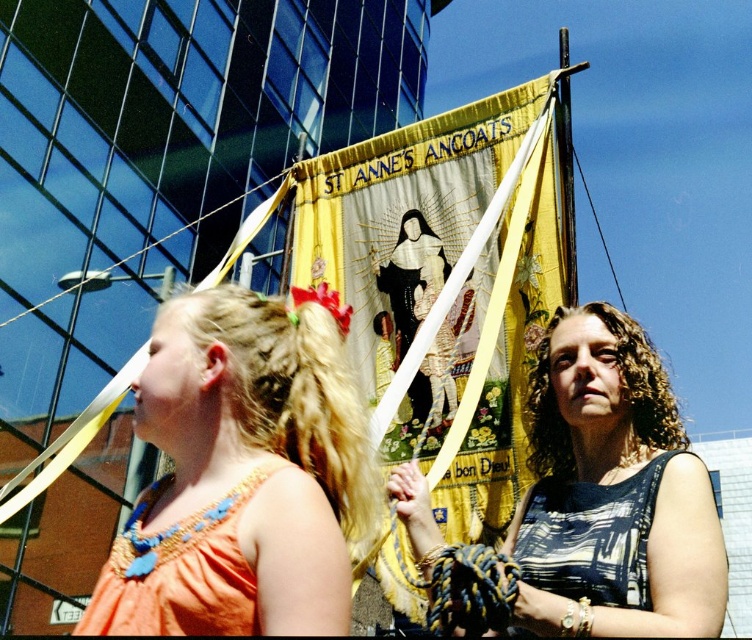
You are a photographer standing near the orange fabric dress at left and want to take a photo of the printed fabric dress at center. Considering the distance between them, will you be able to capture both dresses in the same frame without moving closer?

The distance between the orange fabric dress at left and the printed fabric dress at center is 27.79 feet. Since the photographer is at the orange fabric dress at left, capturing both dresses in the same frame would depend on the camera lens used. A wide angle lens could potentially include both, but a standard or telephoto lens might require moving closer or adjusting the framing.

In the scene described, there are two dresses visible. The orange fabric dress at left and the printed fabric dress at center. Which dress is taller?

The orange fabric dress at left is taller than the printed fabric dress at center.